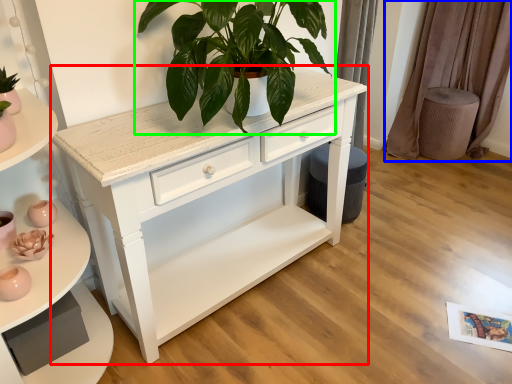
Question: Based on their relative distances, which object is nearer to chest of drawers (highlighted by a red box)? Choose from curtain (highlighted by a blue box) and houseplant (highlighted by a green box).

Choices:
 (A) curtain
 (B) houseplant

Answer: (B)